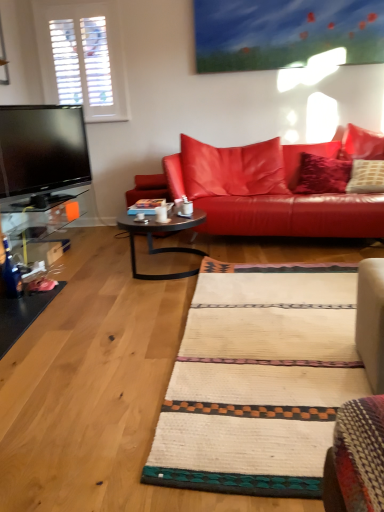
Question: Is white glossy mug at center at the right side of metallic black coffee table at center?

Choices:
 (A) yes
 (B) no

Answer: (B)

Question: Does white glossy mug at center appear on the left side of metallic black coffee table at center?

Choices:
 (A) no
 (B) yes

Answer: (B)

Question: Is there a large distance between white glossy mug at center and metallic black coffee table at center?

Choices:
 (A) no
 (B) yes

Answer: (A)

Question: From the image's perspective, is white glossy mug at center below metallic black coffee table at center?

Choices:
 (A) yes
 (B) no

Answer: (B)

Question: Is white glossy mug at center bigger than metallic black coffee table at center?

Choices:
 (A) no
 (B) yes

Answer: (A)

Question: From the image's perspective, is leather couch at center positioned above or below white glossy mug at center?

Choices:
 (A) below
 (B) above

Answer: (B)

Question: Which is correct: leather couch at center is inside white glossy mug at center, or outside of it?

Choices:
 (A) outside
 (B) inside

Answer: (A)

Question: Is leather couch at center wider or thinner than white glossy mug at center?

Choices:
 (A) wide
 (B) thin

Answer: (A)

Question: Is leather couch at center bigger or smaller than white glossy mug at center?

Choices:
 (A) big
 (B) small

Answer: (A)

Question: In terms of width, does metallic black coffee table at center look wider or thinner when compared to leather couch at center?

Choices:
 (A) thin
 (B) wide

Answer: (A)

Question: From the image's perspective, is metallic black coffee table at center above or below leather couch at center?

Choices:
 (A) above
 (B) below

Answer: (B)

Question: Relative to leather couch at center, is metallic black coffee table at center in front or behind?

Choices:
 (A) behind
 (B) front

Answer: (B)

Question: Is metallic black coffee table at center taller or shorter than leather couch at center?

Choices:
 (A) tall
 (B) short

Answer: (B)

Question: From the image's perspective, is leather couch at center positioned above or below metallic black coffee table at center?

Choices:
 (A) above
 (B) below

Answer: (A)

Question: From their relative heights in the image, would you say leather couch at center is taller or shorter than metallic black coffee table at center?

Choices:
 (A) tall
 (B) short

Answer: (A)